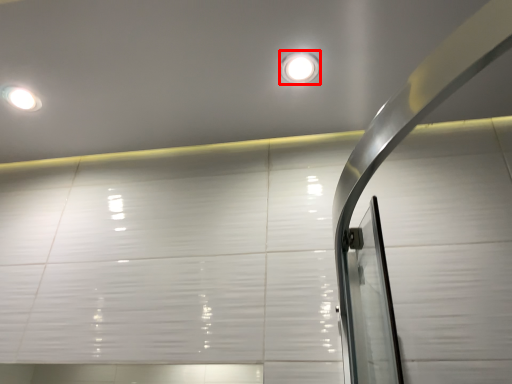
Question: From the image's perspective, where is droplight (annotated by the red box) located in relation to droplight in the image?

Choices:
 (A) below
 (B) above

Answer: (B)